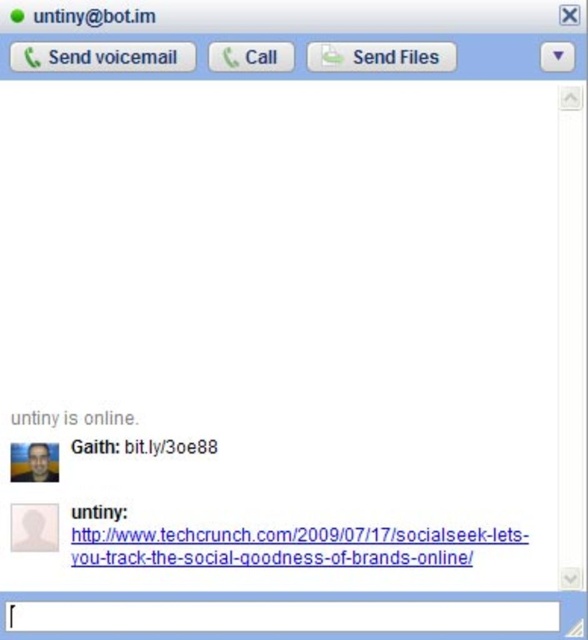
Question: Considering the relative positions of white button at upper left and black link at center in the image provided, where is white button at upper left located with respect to black link at center?

Choices:
 (A) above
 (B) below

Answer: (A)

Question: Which point is closer to the camera taking this photo?

Choices:
 (A) (182, 451)
 (B) (83, 10)

Answer: (B)

Question: Does matte black text at upper left appear under gray text at center?

Choices:
 (A) no
 (B) yes

Answer: (A)

Question: Does white button at upper left come behind matte black text at upper left?

Choices:
 (A) yes
 (B) no

Answer: (A)

Question: Which of the following is the farthest from the observer?

Choices:
 (A) (71, 419)
 (B) (346, 545)
 (C) (35, 13)
 (D) (168, 67)

Answer: (A)

Question: Estimate the real-world distances between objects in this image. Which object is closer to the black text at upper center?

Choices:
 (A) gray text at center
 (B) black text at center
 (C) white button at upper left
 (D) black link at center

Answer: (D)